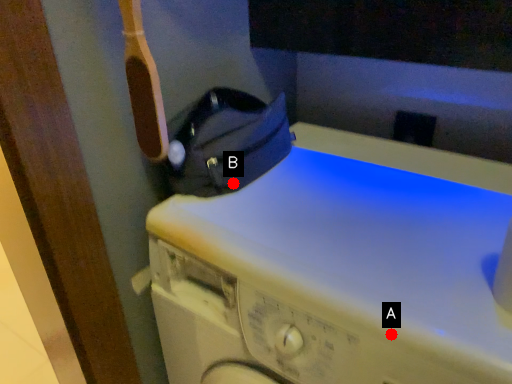
Question: Two points are circled on the image, labeled by A and B beside each circle. Among these points, which one is nearest to the camera?

Choices:
 (A) A is closer
 (B) B is closer

Answer: (A)